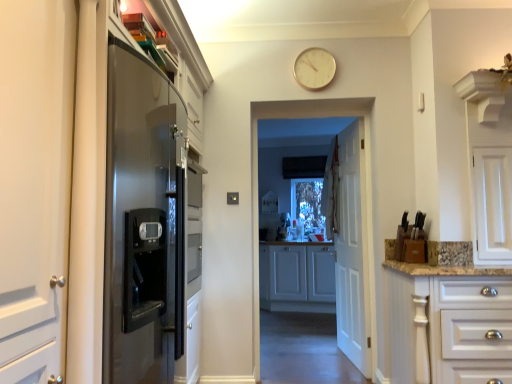
Question: Is white matte cabinet at center, the second cabinetry from the front, at the left side of white wooden door at center?

Choices:
 (A) no
 (B) yes

Answer: (B)

Question: Is white matte cabinet at center, the 1th cabinetry viewed from the back, aimed at white wooden door at center?

Choices:
 (A) no
 (B) yes

Answer: (B)

Question: Are white matte cabinet at center, the second cabinetry from the front, and white wooden door at center far apart?

Choices:
 (A) yes
 (B) no

Answer: (A)

Question: From a real-world perspective, is white matte cabinet at center, the second cabinetry from the front, physically below white wooden door at center?

Choices:
 (A) yes
 (B) no

Answer: (A)

Question: Is white matte cabinet at center, the 1th cabinetry viewed from the back, taller than white wooden door at center?

Choices:
 (A) no
 (B) yes

Answer: (A)

Question: Could white wooden door at center be considered to be inside white matte cabinet at center, the 1th cabinetry viewed from the back?

Choices:
 (A) no
 (B) yes

Answer: (A)

Question: Is white matte cabinet at center, the 1th cabinetry viewed from the back, not near white glossy cabinet at right, which appears as the first cabinetry when viewed from the front?

Choices:
 (A) no
 (B) yes

Answer: (B)

Question: Can white glossy cabinet at right, which appears as the first cabinetry when viewed from the front, be found inside white matte cabinet at center, the second cabinetry from the front?

Choices:
 (A) yes
 (B) no

Answer: (B)

Question: Could you tell me if white matte cabinet at center, the second cabinetry from the front, is turned towards white glossy cabinet at right, acting as the 2th cabinetry starting from the back?

Choices:
 (A) no
 (B) yes

Answer: (B)

Question: Does white matte cabinet at center, the second cabinetry from the front, have a lesser width compared to white glossy cabinet at right, which appears as the first cabinetry when viewed from the front?

Choices:
 (A) yes
 (B) no

Answer: (A)

Question: Can you confirm if white matte cabinet at center, the second cabinetry from the front, is taller than white glossy cabinet at right, acting as the 2th cabinetry starting from the back?

Choices:
 (A) no
 (B) yes

Answer: (B)

Question: Is white matte cabinet at center, the 1th cabinetry viewed from the back, shorter than white glossy cabinet at right, which appears as the first cabinetry when viewed from the front?

Choices:
 (A) yes
 (B) no

Answer: (B)

Question: Is white glossy cabinet at right, which appears as the first cabinetry when viewed from the front, positioned far away from gold metallic clock at upper center?

Choices:
 (A) no
 (B) yes

Answer: (B)